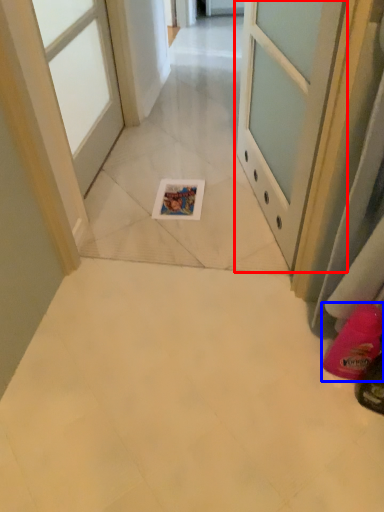
Question: Among these objects, which one is farthest to the camera, door (highlighted by a red box) or footwear (highlighted by a blue box)?

Choices:
 (A) door
 (B) footwear

Answer: (B)